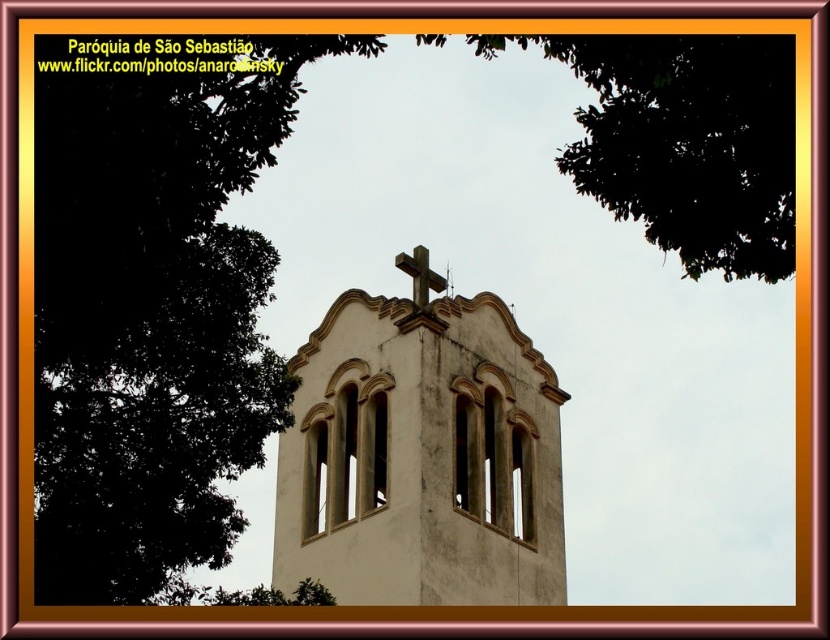
Who is taller, white textured tower at center or rustic wooden cross at center?

white textured tower at center is taller.

Does point (404, 490) come farther from viewer compared to point (398, 260)?

No, (404, 490) is in front of (398, 260).

What do you see at coordinates (421, 458) in the screenshot? I see `white textured tower at center` at bounding box center [421, 458].

Image resolution: width=830 pixels, height=640 pixels. Identify the location of white textured tower at center. (421, 458).